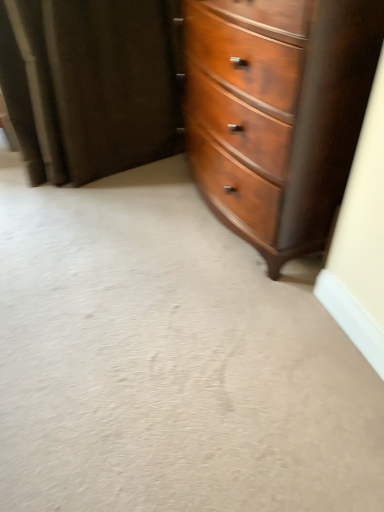
Measure the distance between point [67,78] and camera.

A distance of 1.96 meters exists between point [67,78] and camera.

Locate an element on the screen. velvet dark brown curtain at upper left is located at coordinates (90, 85).

Image resolution: width=384 pixels, height=512 pixels. What do you see at coordinates (90, 85) in the screenshot? I see `velvet dark brown curtain at upper left` at bounding box center [90, 85].

What is the approximate width of velvet dark brown curtain at upper left?

17.83 inches.

What is the approximate height of shiny brown wood chest of drawers at center?

1.02 meters.

Find the location of a particular element. The width and height of the screenshot is (384, 512). shiny brown wood chest of drawers at center is located at coordinates (278, 119).

This screenshot has width=384, height=512. What do you see at coordinates (278, 119) in the screenshot? I see `shiny brown wood chest of drawers at center` at bounding box center [278, 119].

Locate an element on the screen. The width and height of the screenshot is (384, 512). velvet dark brown curtain at upper left is located at coordinates (90, 85).

Is velvet dark brown curtain at upper left to the left of shiny brown wood chest of drawers at center from the viewer's perspective?

Yes, velvet dark brown curtain at upper left is to the left of shiny brown wood chest of drawers at center.

From the picture: Which object is further away from the camera taking this photo, velvet dark brown curtain at upper left or shiny brown wood chest of drawers at center?

velvet dark brown curtain at upper left is more distant.

Is point (31, 56) closer to viewer compared to point (200, 86)?

No, it is not.

From the image's perspective, who appears lower, velvet dark brown curtain at upper left or shiny brown wood chest of drawers at center?

shiny brown wood chest of drawers at center is shown below in the image.

From a real-world perspective, who is located lower, velvet dark brown curtain at upper left or shiny brown wood chest of drawers at center?

velvet dark brown curtain at upper left.

Considering the sizes of objects velvet dark brown curtain at upper left and shiny brown wood chest of drawers at center in the image provided, who is wider, velvet dark brown curtain at upper left or shiny brown wood chest of drawers at center?

With larger width is shiny brown wood chest of drawers at center.

Does velvet dark brown curtain at upper left have a lesser height compared to shiny brown wood chest of drawers at center?

Yes, velvet dark brown curtain at upper left is shorter than shiny brown wood chest of drawers at center.

In the scene shown: Which of these two, velvet dark brown curtain at upper left or shiny brown wood chest of drawers at center, is smaller?

velvet dark brown curtain at upper left.

Based on the photo, does velvet dark brown curtain at upper left contain shiny brown wood chest of drawers at center?

No, shiny brown wood chest of drawers at center is not surrounded by velvet dark brown curtain at upper left.

Are velvet dark brown curtain at upper left and shiny brown wood chest of drawers at center far apart?

No, velvet dark brown curtain at upper left is not far from shiny brown wood chest of drawers at center.

Is velvet dark brown curtain at upper left oriented away from shiny brown wood chest of drawers at center?

velvet dark brown curtain at upper left is not turned away from shiny brown wood chest of drawers at center.

How many degrees apart are the facing directions of velvet dark brown curtain at upper left and shiny brown wood chest of drawers at center?

They differ by 90.4 degrees in their facing directions.

Locate an element on the screen. The width and height of the screenshot is (384, 512). the chest of drawers located above the velvet dark brown curtain at upper left (from a real-world perspective) is located at coordinates (278, 119).

Is shiny brown wood chest of drawers at center to the right of velvet dark brown curtain at upper left from the viewer's perspective?

Yes.

Who is more distant, shiny brown wood chest of drawers at center or velvet dark brown curtain at upper left?

velvet dark brown curtain at upper left is more distant.

Is point (287, 185) closer or farther from the camera than point (129, 70)?

Clearly, point (287, 185) is closer to the camera than point (129, 70).

From the image's perspective, which one is positioned higher, shiny brown wood chest of drawers at center or velvet dark brown curtain at upper left?

velvet dark brown curtain at upper left.

From a real-world perspective, who is located higher, shiny brown wood chest of drawers at center or velvet dark brown curtain at upper left?

shiny brown wood chest of drawers at center, from a real-world perspective.

Considering the sizes of objects shiny brown wood chest of drawers at center and velvet dark brown curtain at upper left in the image provided, who is thinner, shiny brown wood chest of drawers at center or velvet dark brown curtain at upper left?

Thinner between the two is velvet dark brown curtain at upper left.

In terms of height, does shiny brown wood chest of drawers at center look taller or shorter compared to velvet dark brown curtain at upper left?

Clearly, shiny brown wood chest of drawers at center is taller compared to velvet dark brown curtain at upper left.

Can you confirm if shiny brown wood chest of drawers at center is smaller than velvet dark brown curtain at upper left?

No.

Would you say shiny brown wood chest of drawers at center is outside velvet dark brown curtain at upper left?

Indeed, shiny brown wood chest of drawers at center is completely outside velvet dark brown curtain at upper left.

Is shiny brown wood chest of drawers at center directly adjacent to velvet dark brown curtain at upper left?

shiny brown wood chest of drawers at center and velvet dark brown curtain at upper left are not in contact.

Is shiny brown wood chest of drawers at center oriented away from velvet dark brown curtain at upper left?

shiny brown wood chest of drawers at center is not turned away from velvet dark brown curtain at upper left.

What's the angular difference between shiny brown wood chest of drawers at center and velvet dark brown curtain at upper left's facing directions?

They differ by 90.4 degrees in their facing directions.

This screenshot has height=512, width=384. In the image, there is a velvet dark brown curtain at upper left. Find the location of `the chest of drawers below it (from the image's perspective)`. the chest of drawers below it (from the image's perspective) is located at coordinates (278, 119).

I want to click on curtain lying above the shiny brown wood chest of drawers at center (from the image's perspective), so tap(90, 85).

What are the coordinates of `curtain below the shiny brown wood chest of drawers at center (from a real-world perspective)` in the screenshot? It's located at (90, 85).